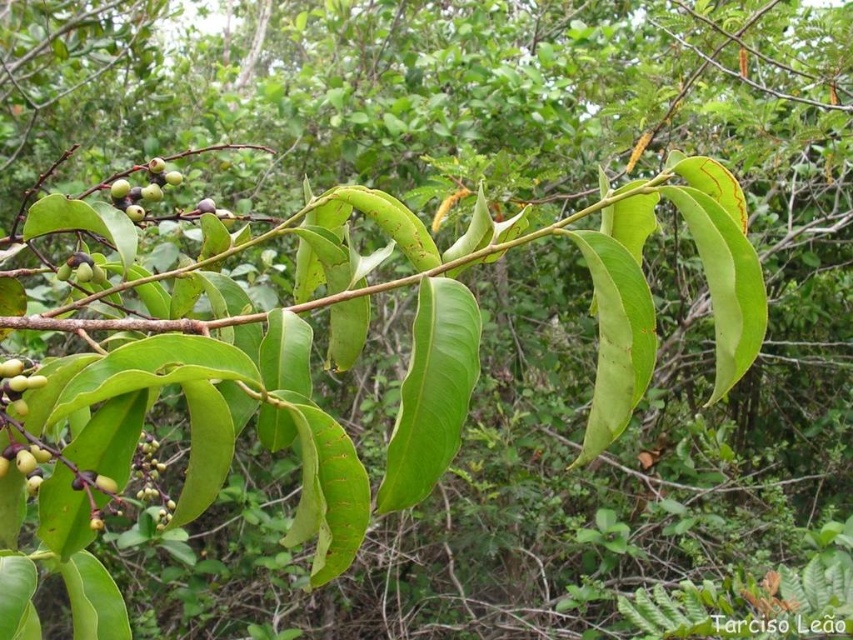
Between point (148, 193) and point (26, 372), which one is positioned behind?

The point (148, 193) is more distant.

Does green matte berries at upper left have a lesser height compared to green matte fruit at lower left?

No.

Is point (154, 189) closer to camera compared to point (16, 369)?

No, it is behind (16, 369).

Locate an element on the screen. The height and width of the screenshot is (640, 853). green matte berries at upper left is located at coordinates (142, 189).

Who is taller, green glossy leaves at center or green matte berry at center-left?

green glossy leaves at center

Who is more forward, (99, 323) or (77, 280)?

Positioned in front is point (99, 323).

Where is `green glossy leaves at center`? This screenshot has width=853, height=640. green glossy leaves at center is located at coordinates pos(117,323).

Is green matte fruit at lower left wider than green matte berry at center-left?

Correct, the width of green matte fruit at lower left exceeds that of green matte berry at center-left.

Is point (6, 404) more distant than point (76, 262)?

No, (6, 404) is in front of (76, 262).

Does point (21, 387) come closer to viewer compared to point (77, 282)?

Yes.

At what (x,y) coordinates should I click in order to perform the action: click on green matte fruit at lower left. Please return your answer as a coordinate pair (x, y). The width and height of the screenshot is (853, 640). Looking at the image, I should click on (15, 387).